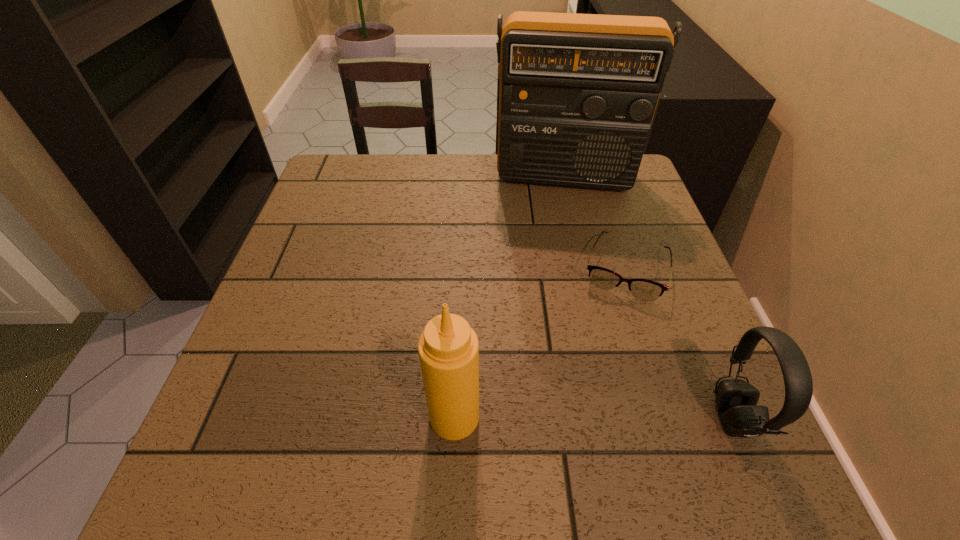
This screenshot has height=540, width=960. In the image, there is a desktop. In order to click on free region at the near right corner in this screenshot , I will do `click(698, 392)`.

Where is `free space between the third nearest object and the leftmost object`? free space between the third nearest object and the leftmost object is located at coordinates (540, 343).

Where is `empty location between the headset and the leftmost object`? This screenshot has width=960, height=540. empty location between the headset and the leftmost object is located at coordinates (594, 417).

I want to click on vacant area that lies between the condiment and the radio receiver, so click(509, 297).

Where is `vacant space in between the shortest object and the third shortest object`? This screenshot has width=960, height=540. vacant space in between the shortest object and the third shortest object is located at coordinates (540, 343).

This screenshot has width=960, height=540. Find the location of `vacant space in between the tallest object and the leftmost object`. vacant space in between the tallest object and the leftmost object is located at coordinates (509, 297).

Find the location of `empty location between the spectacles and the second shortest object`. empty location between the spectacles and the second shortest object is located at coordinates 680,343.

What are the coordinates of `free space between the spectacles and the radio receiver` in the screenshot? It's located at (594, 223).

Locate an element on the screen. The height and width of the screenshot is (540, 960). free point between the third shortest object and the radio receiver is located at coordinates (509, 297).

Identify which object is the second nearest to the leftmost object. Please provide its 2D coordinates. Your answer should be formatted as a tuple, i.e. [(x, y)], where the tuple contains the x and y coordinates of a point satisfying the conditions above.

[(736, 400)]